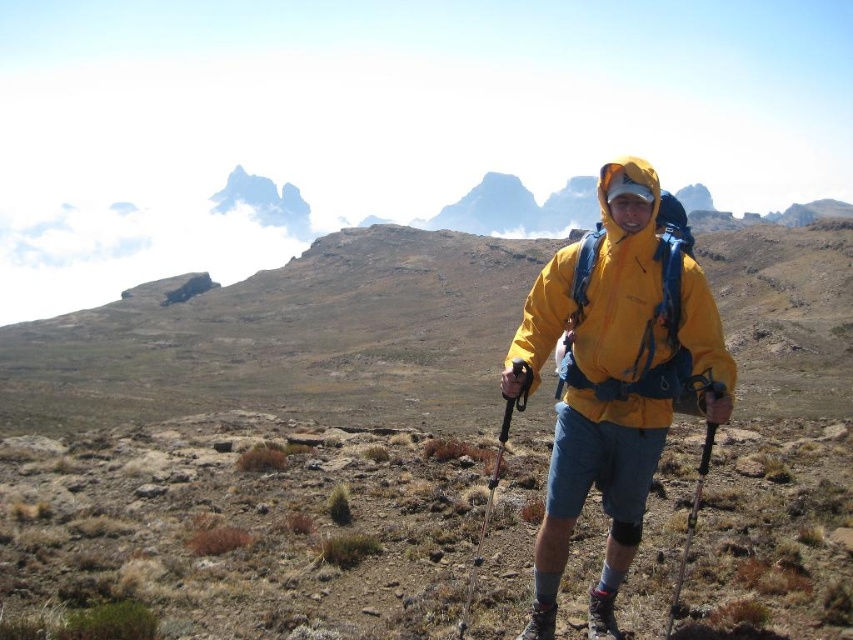
You are a hiker trying to decide which item to place in a narrow compartment of your backpack. The compartment can only fit items narrower than the other. Which item should you choose between the black plastic ski pole at lower right and the brushed leather hiking boot at lower center?

The brushed leather hiking boot at lower center is narrower than the black plastic ski pole at lower right, so you should choose the brushed leather hiking boot at lower center to fit in the narrow compartment.

You are a hiker who has just finished a challenging trek and wants to place your black plastic ski pole at lower right in a specific location. According to the coordinates provided, where should you place it?

The black plastic ski pole at lower right should be placed at point (691, 522) according to the coordinates provided.